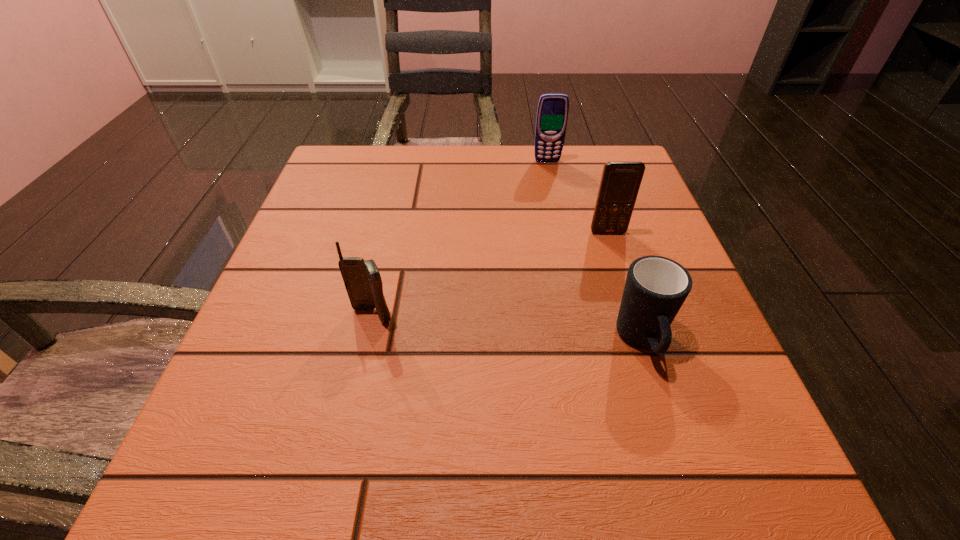
You are a GUI agent. You are given a task and a screenshot of the screen. Output one action in this format:
    pyautogui.click(x=<x>, y=<y>)
    Task: Click on the vacant region located 0.170m on the side of the mug with the handle
    
    Given the screenshot: What is the action you would take?
    pyautogui.click(x=692, y=502)

This screenshot has width=960, height=540. I want to click on object at the far edge, so click(x=552, y=112).

The width and height of the screenshot is (960, 540). What are the coordinates of `object that is at the left edge` in the screenshot? It's located at (362, 279).

This screenshot has height=540, width=960. I want to click on cellular telephone located at the right edge, so click(620, 182).

Where is `mug that is at the right edge`? mug that is at the right edge is located at coordinates 656,287.

In the image, there is a desktop. Where is `vacant space at the far edge`? Image resolution: width=960 pixels, height=540 pixels. vacant space at the far edge is located at coordinates (409, 181).

This screenshot has height=540, width=960. In order to click on vacant space at the near edge of the desktop in this screenshot , I will do `click(541, 509)`.

You are a GUI agent. You are given a task and a screenshot of the screen. Output one action in this format:
    pyautogui.click(x=<x>, y=<y>)
    Task: Click on the vacant space at the left edge of the desktop
    This screenshot has width=960, height=540.
    Given the screenshot: What is the action you would take?
    pyautogui.click(x=363, y=232)

Image resolution: width=960 pixels, height=540 pixels. I want to click on free space at the right edge of the desktop, so click(x=592, y=202).

In the image, there is a desktop. Identify the location of vacant space at the far left corner. This screenshot has height=540, width=960. (332, 201).